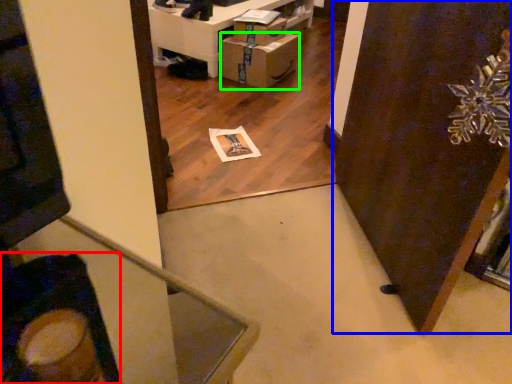
Question: Estimate the real-world distances between objects in this image. Which object is farther from swivel chair (highlighted by a red box), door (highlighted by a blue box) or cardboard box (highlighted by a green box)?

Choices:
 (A) door
 (B) cardboard box

Answer: (B)